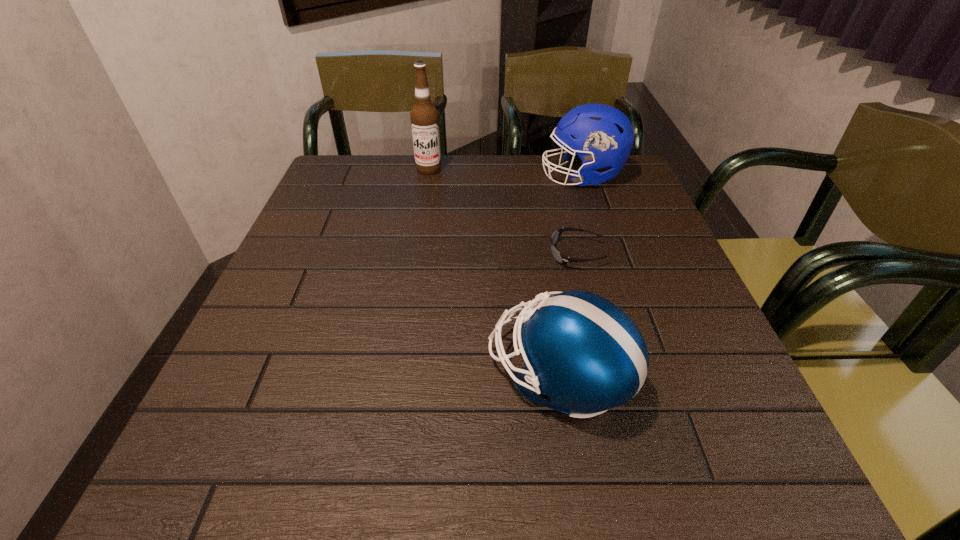
The image size is (960, 540). Identify the location of alcohol. (424, 116).

Where is `the leftmost object`? The width and height of the screenshot is (960, 540). the leftmost object is located at coordinates (424, 116).

Where is `the farther football helmet`? The image size is (960, 540). the farther football helmet is located at coordinates (603, 136).

Where is `the nearest object`? The height and width of the screenshot is (540, 960). the nearest object is located at coordinates (583, 355).

In order to click on the shortest object in this screenshot , I will do `click(559, 257)`.

At what (x,y) coordinates should I click in order to perform the action: click on the third farthest object. Please return your answer as a coordinate pair (x, y). Looking at the image, I should click on (559, 257).

Find the location of a particular element. Image resolution: width=960 pixels, height=540 pixels. free region located on the label of the alcohol is located at coordinates (413, 264).

Where is `vacant space located 0.110m on the front-facing side of the farther football helmet`? This screenshot has height=540, width=960. vacant space located 0.110m on the front-facing side of the farther football helmet is located at coordinates (501, 177).

Locate an element on the screen. free point located 0.350m on the front-facing side of the farther football helmet is located at coordinates [x=414, y=177].

At what (x,y) coordinates should I click in order to perform the action: click on free region located 0.100m on the front-facing side of the farther football helmet. Please return your answer as a coordinate pair (x, y). Looking at the image, I should click on (504, 177).